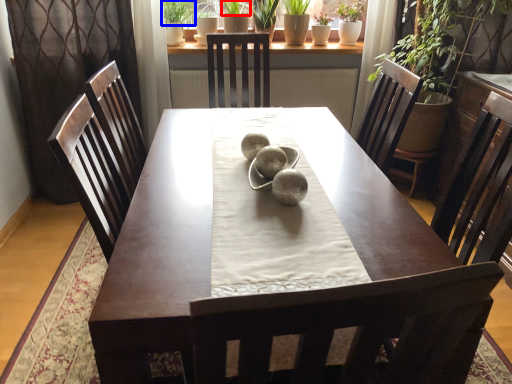
Question: Which object appears closest to the camera in this image, plant (highlighted by a red box) or plant (highlighted by a blue box)?

Choices:
 (A) plant
 (B) plant

Answer: (B)